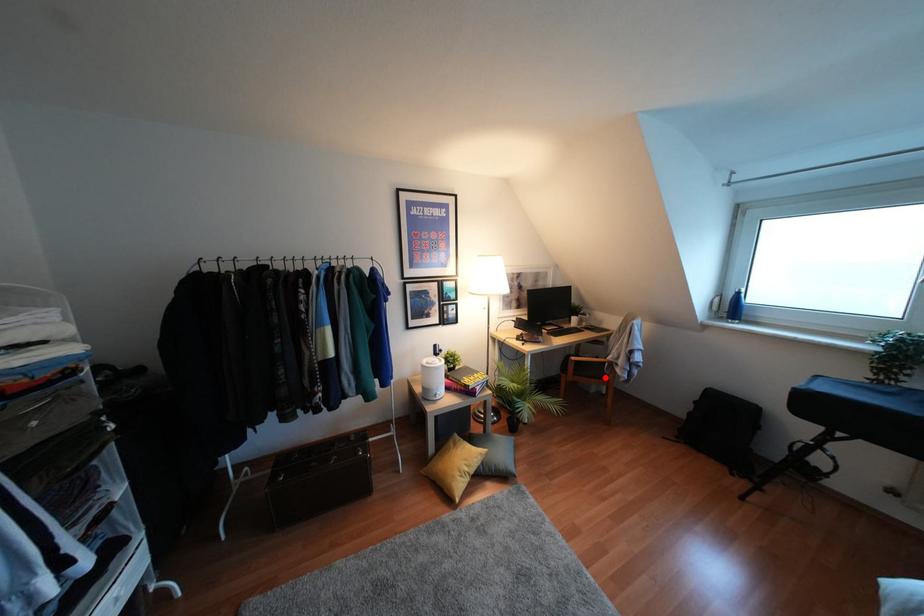
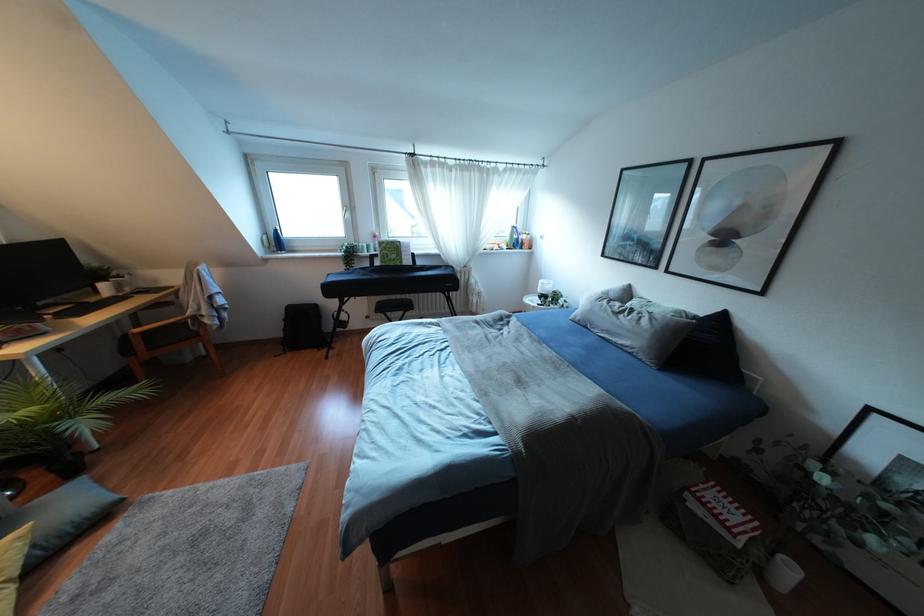
The point at the highlighted location is marked in the first image. Where is the corresponding point in the second image?

(196, 334)